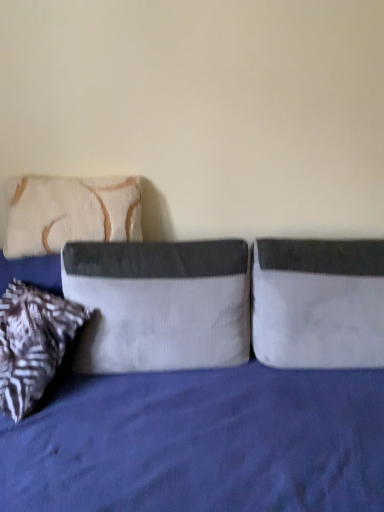
Question: Is velvet gray pillow at center, which ranks as the second pillow in left-to-right order, further to camera compared to beige textured pillow at left, the 3th pillow when ordered from right to left?

Choices:
 (A) no
 (B) yes

Answer: (A)

Question: Considering the relative sizes of velvet gray pillow at center, which appears as the 2th pillow when viewed from the right, and beige textured pillow at left, the 3th pillow when ordered from right to left, in the image provided, is velvet gray pillow at center, which appears as the 2th pillow when viewed from the right, smaller than beige textured pillow at left, the 3th pillow when ordered from right to left,?

Choices:
 (A) yes
 (B) no

Answer: (B)

Question: Is velvet gray pillow at center, which appears as the 2th pillow when viewed from the right, thinner than beige textured pillow at left, placed as the first pillow when sorted from left to right?

Choices:
 (A) yes
 (B) no

Answer: (B)

Question: Is velvet gray pillow at center, which appears as the 2th pillow when viewed from the right, facing towards beige textured pillow at left, the 3th pillow when ordered from right to left?

Choices:
 (A) yes
 (B) no

Answer: (B)

Question: Can you confirm if velvet gray pillow at center, which ranks as the second pillow in left-to-right order, is shorter than beige textured pillow at left, placed as the first pillow when sorted from left to right?

Choices:
 (A) yes
 (B) no

Answer: (B)

Question: Would you say velvet gray pillow at center, which appears as the 2th pillow when viewed from the right, is inside or outside white fabric pillow at right, the 3th pillow when ordered from left to right?

Choices:
 (A) inside
 (B) outside

Answer: (B)

Question: In terms of width, does velvet gray pillow at center, which ranks as the second pillow in left-to-right order, look wider or thinner when compared to white fabric pillow at right, the 3th pillow when ordered from left to right?

Choices:
 (A) wide
 (B) thin

Answer: (A)

Question: From the image's perspective, is velvet gray pillow at center, which appears as the 2th pillow when viewed from the right, located above or below white fabric pillow at right, the 3th pillow when ordered from left to right?

Choices:
 (A) above
 (B) below

Answer: (A)

Question: In the image, is velvet gray pillow at center, which ranks as the second pillow in left-to-right order, on the left side or the right side of white fabric pillow at right, placed as the first pillow when sorted from right to left?

Choices:
 (A) right
 (B) left

Answer: (B)

Question: From a real-world perspective, is velvet blue bed at center above or below beige textured pillow at left, the 3th pillow when ordered from right to left?

Choices:
 (A) below
 (B) above

Answer: (A)

Question: Considering the positions of velvet blue bed at center and beige textured pillow at left, placed as the first pillow when sorted from left to right, in the image, is velvet blue bed at center taller or shorter than beige textured pillow at left, placed as the first pillow when sorted from left to right,?

Choices:
 (A) short
 (B) tall

Answer: (B)

Question: Visually, is velvet blue bed at center positioned to the left or to the right of beige textured pillow at left, placed as the first pillow when sorted from left to right?

Choices:
 (A) left
 (B) right

Answer: (B)

Question: Considering the positions of velvet blue bed at center and beige textured pillow at left, the 3th pillow when ordered from right to left, in the image, is velvet blue bed at center bigger or smaller than beige textured pillow at left, the 3th pillow when ordered from right to left,?

Choices:
 (A) small
 (B) big

Answer: (B)

Question: Is point (339, 310) positioned closer to the camera than point (238, 297)?

Choices:
 (A) closer
 (B) farther

Answer: (A)

Question: Relative to velvet gray pillow at center, which appears as the 2th pillow when viewed from the right, is white fabric pillow at right, the 3th pillow when ordered from left to right, in front or behind?

Choices:
 (A) behind
 (B) front

Answer: (A)